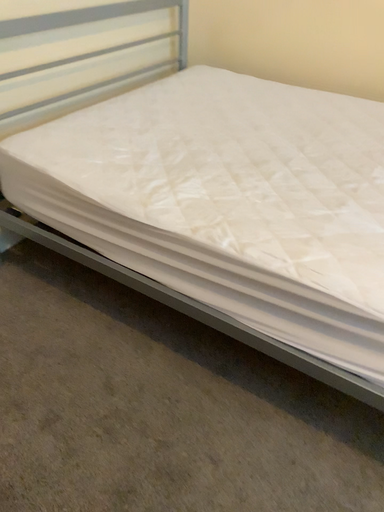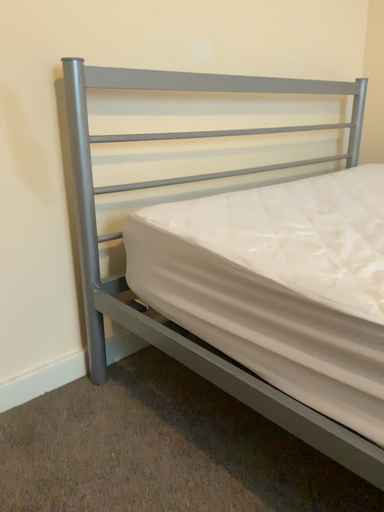
Question: How did the camera likely rotate when shooting the video?

Choices:
 (A) rotated upward
 (B) rotated downward

Answer: (A)